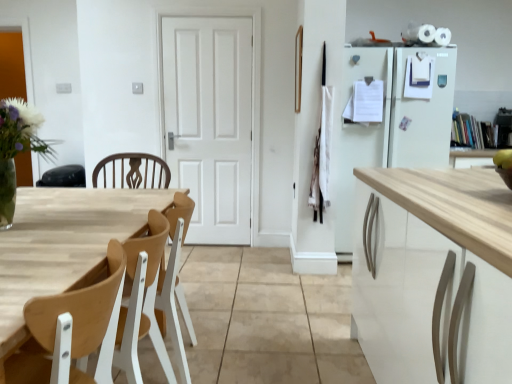
Describe the element at coordinates (210, 122) in the screenshot. I see `white matte door at center` at that location.

What are the coordinates of `white matte door at center` in the screenshot? It's located at (210, 122).

The width and height of the screenshot is (512, 384). Describe the element at coordinates (63, 245) in the screenshot. I see `wooden table at left` at that location.

Where is `wooden at left`? wooden at left is located at coordinates (79, 311).

Where is `white matte door at center`? white matte door at center is located at coordinates (210, 122).

Where is `chair located below the clear glass vase at left (from the image's perspective)`? The width and height of the screenshot is (512, 384). chair located below the clear glass vase at left (from the image's perspective) is located at coordinates (79, 311).

Between clear glass vase at left and wooden at left, which one has larger width?

wooden at left is wider.

Consider the image. Is there a large distance between clear glass vase at left and wooden at left?

clear glass vase at left is near wooden at left, not far away.

Between wooden table at left and wooden at left, which one has smaller size?

wooden at left is smaller.

Is wooden table at left in front of wooden at left?

That is True.

Can you confirm if wooden table at left is shorter than wooden at left?

Incorrect, the height of wooden table at left does not fall short of that of wooden at left.

How much distance is there between wooden table at left and wooden at left?

wooden table at left and wooden at left are 15.38 inches apart.

This screenshot has height=384, width=512. I want to click on chair in front of the clear glass vase at left, so click(x=79, y=311).

Considering the positions of objects wooden at left and clear glass vase at left in the image provided, who is more to the left, wooden at left or clear glass vase at left?

From the viewer's perspective, clear glass vase at left appears more on the left side.

From the picture: From the image's perspective, which object appears higher, wooden at left or clear glass vase at left?

clear glass vase at left.

Is wooden table at left at the left side of white matte door at center?

Correct, you'll find wooden table at left to the left of white matte door at center.

Is wooden table at left oriented towards white matte door at center?

No, wooden table at left is not turned towards white matte door at center.

I want to click on table on the left side of white matte door at center, so click(63, 245).

Does white matte door at center have a lesser width compared to wooden table at left?

Correct, the width of white matte door at center is less than that of wooden table at left.

Would you say white matte door at center is to the left or to the right of wooden table at left in the picture?

In the image, white matte door at center appears on the right side of wooden table at left.

From the image's perspective, is white matte door at center located above or below wooden table at left?

From the image's perspective, white matte door at center appears above wooden table at left.

What's the angular difference between wooden at left and wooden table at left's facing directions?

The angular difference between wooden at left and wooden table at left is 180 degrees.

From the picture: Is wooden table at left completely or partially inside wooden at left?

Definitely not — wooden table at left is not inside wooden at left.

Which is behind, point (121, 248) or point (55, 279)?

Positioned behind is point (121, 248).

Which of these two, wooden at left or wooden table at left, is wider?

wooden table at left is wider.

Locate an element on the screen. This screenshot has height=384, width=512. floral arrangement behind the wooden table at left is located at coordinates (17, 148).

Is clear glass vase at left located outside wooden table at left?

clear glass vase at left is positioned outside wooden table at left.

In the image, is clear glass vase at left positioned in front of or behind wooden table at left?

In the image, clear glass vase at left appears behind wooden table at left.

From a real-world perspective, relative to wooden table at left, is clear glass vase at left vertically above or below?

Clearly, from a real-world perspective, clear glass vase at left is above wooden table at left.

Locate an element on the screen. This screenshot has height=384, width=512. floral arrangement behind the wooden at left is located at coordinates (17, 148).

Locate an element on the screen. table in front of the wooden at left is located at coordinates (63, 245).

When comparing their distances from clear glass vase at left, does wooden table at left or white matte door at center seem further?

white matte door at center lies further to clear glass vase at left than the other object.

Considering their positions, is clear glass vase at left positioned closer to wooden table at left than wooden at left?

Among the two, clear glass vase at left is located nearer to wooden table at left.

When comparing their distances from clear glass vase at left, does wooden table at left or wooden at left seem further?

wooden at left.

Looking at the image, which one is located closer to wooden table at left, wooden at left or white matte door at center?

Among the two, wooden at left is located nearer to wooden table at left.

From the image, which object appears to be farther from white matte door at center, clear glass vase at left or wooden table at left?

clear glass vase at left is positioned further to the anchor white matte door at center.

In the scene shown: When comparing their distances from wooden table at left, does wooden at left or clear glass vase at left seem further?

Among the two, wooden at left is located further to wooden table at left.

Based on their spatial positions, is white matte door at center or clear glass vase at left closer to wooden at left?

clear glass vase at left is positioned closer to the anchor wooden at left.

Estimate the real-world distances between objects in this image. Which object is closer to white matte door at center, clear glass vase at left or wooden at left?

clear glass vase at left is closer to white matte door at center.

The width and height of the screenshot is (512, 384). In order to click on chair between wooden table at left and white matte door at center in the front-back direction in this screenshot , I will do `click(79, 311)`.

The height and width of the screenshot is (384, 512). I want to click on chair that lies between clear glass vase at left and wooden table at left from top to bottom, so point(79,311).

Find the location of a particular element. floral arrangement positioned between wooden at left and white matte door at center from near to far is located at coordinates (17, 148).

Locate an element on the screen. This screenshot has height=384, width=512. floral arrangement between wooden table at left and white matte door at center from front to back is located at coordinates (17, 148).